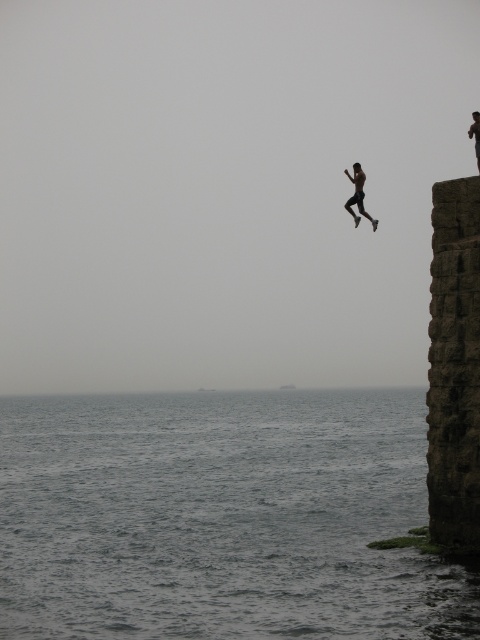
You are a photographer aiming to capture the dark stone pillar at right and the black matte person at upper right in a single frame. Based on their sizes in the image, which object should you focus on first to ensure both are clearly visible?

The dark stone pillar at right occupies less space than the black matte person at upper right, so you should focus on the black matte person at upper right first to ensure both are clearly visible.

You are a photographer standing at the edge of the cliff. You notice the gray water at lower left and the dark stone pillar at right in your viewfinder. Which object is positioned to the left of the other?

The gray water at lower left is positioned to the left of the dark stone pillar at right.

Looking at this image, you are a photographer planning to capture the cliff diver and the surrounding elements. Given the gray water at lower left and the dark stone pillar at right, which object should you focus on to ensure it appears larger in your photo?

The gray water at lower left should be focused on because it is bigger than the dark stone pillar at right, making it the larger object in the scene.